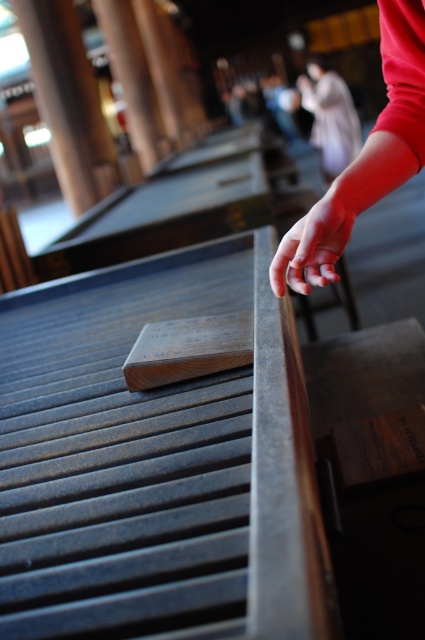
Question: Which of the following is the closest to the observer?

Choices:
 (A) (328, 141)
 (B) (311, 221)
 (C) (48, 20)
 (D) (421, 166)

Answer: (B)

Question: In this image, where is smooth red arm at upper right located relative to smooth red hand at upper right?

Choices:
 (A) above
 (B) below

Answer: (B)

Question: Among these objects, which one is nearest to the camera?

Choices:
 (A) smooth red hand at upper right
 (B) smooth brown wood at upper left
 (C) smooth beige robe at upper center

Answer: (A)

Question: Does smooth red arm at upper right appear over smooth brown wood at upper left?

Choices:
 (A) yes
 (B) no

Answer: (B)

Question: In this image, where is smooth red arm at upper right located relative to smooth brown wood at upper left?

Choices:
 (A) right
 (B) left

Answer: (A)

Question: Estimate the real-world distances between objects in this image. Which object is closer to the smooth red hand at upper right?

Choices:
 (A) smooth brown wood at upper left
 (B) smooth beige robe at upper center
 (C) smooth red arm at upper right

Answer: (A)